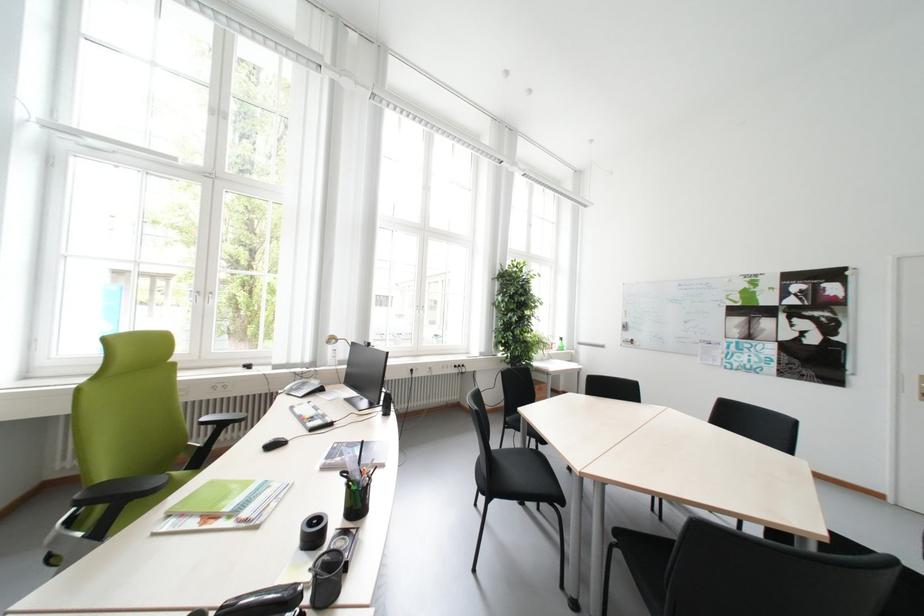
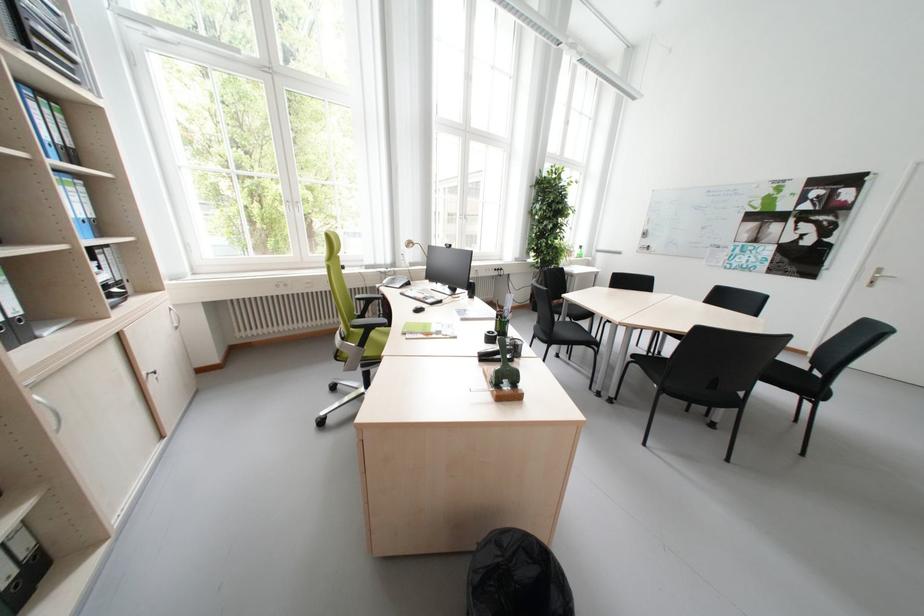
Question: The images are taken continuously from a first-person perspective. In which direction is your viewpoint rotating?

Choices:
 (A) Left
 (B) Right
 (C) Up
 (D) Down

Answer: (D)